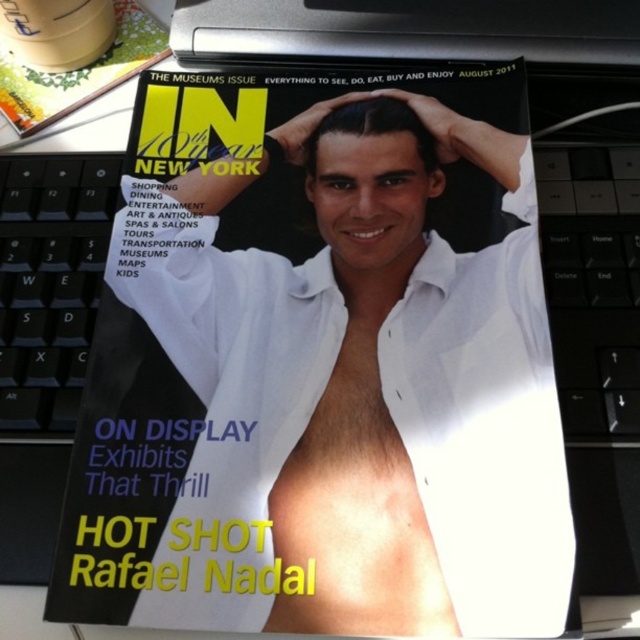
Consider the image. You are organizing a desk and need to move the white matte shirt at center and the black plastic keyboard at left. If you want to place them side by side without overlapping, which object should be placed to the left to ensure they are aligned properly?

The black plastic keyboard at left should be placed to the left since the white matte shirt at center is currently positioned on the right side of the black plastic keyboard at left, so moving them side by side would require the keyboard to be on the left and the shirt on the right to maintain their original relative positions.

You are designing a layout for a magazine cover and want to ensure the white matte shirt at center and the matte yellow magazine at upper left are positioned correctly. Based on the scene, which object is taller?

The white matte shirt at center is taller than the matte yellow magazine at upper left.